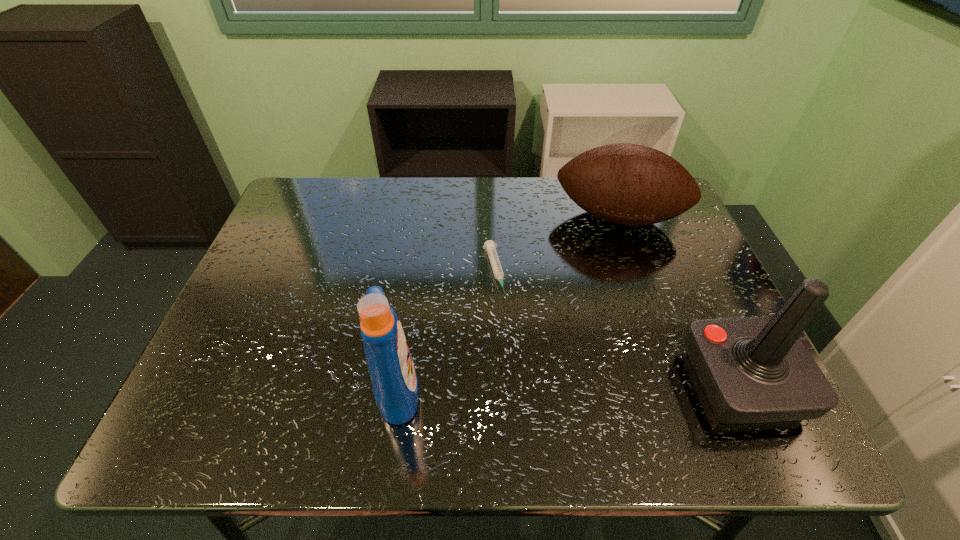
At what (x,y) coordinates should I click in order to perform the action: click on vacant space that satisfies the following two spatial constraints: 1. on the front side of the joystick; 2. on the left side of the second shortest object. Please return your answer as a coordinate pair (x, y). The width and height of the screenshot is (960, 540). Looking at the image, I should click on (677, 383).

The width and height of the screenshot is (960, 540). What are the coordinates of `vacant area in the image that satisfies the following two spatial constraints: 1. on the back side of the third tallest object; 2. on the right side of the syringe` in the screenshot? It's located at (492, 218).